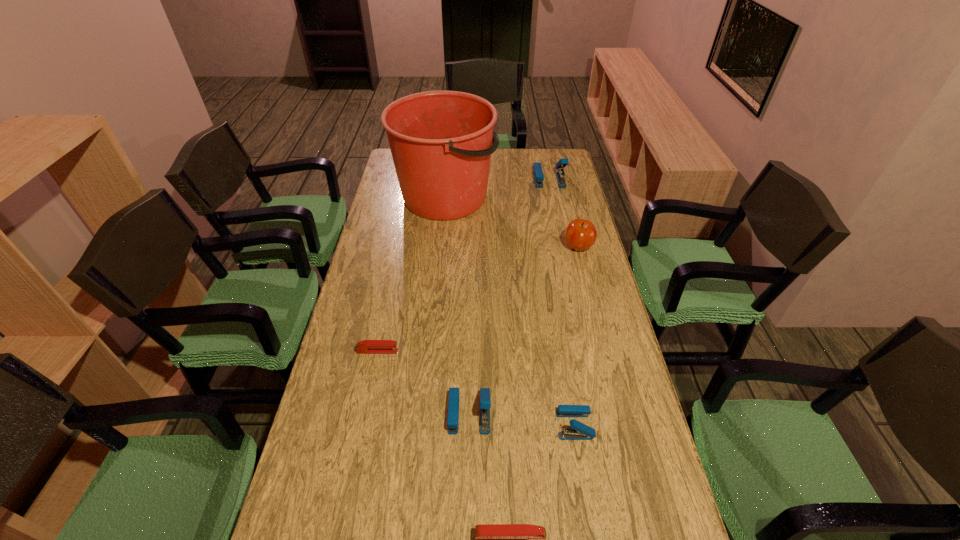
Find the location of a particular element. The height and width of the screenshot is (540, 960). bucket is located at coordinates (441, 142).

In order to click on the tallest object in this screenshot , I will do `click(441, 142)`.

Image resolution: width=960 pixels, height=540 pixels. I want to click on the biggest blue stapler, so click(x=537, y=172).

Image resolution: width=960 pixels, height=540 pixels. In order to click on the farthest stapler in this screenshot , I will do `click(537, 172)`.

Locate an element on the screen. The width and height of the screenshot is (960, 540). apple is located at coordinates point(580,234).

Locate an element on the screen. the fourth shortest stapler is located at coordinates (485, 401).

The width and height of the screenshot is (960, 540). Find the location of `the second smallest blue stapler`. the second smallest blue stapler is located at coordinates (485, 401).

Locate an element on the screen. the third shortest stapler is located at coordinates (579, 431).

Locate an element on the screen. The width and height of the screenshot is (960, 540). the smallest blue stapler is located at coordinates (579, 431).

Where is `the shortest object`? The image size is (960, 540). the shortest object is located at coordinates [366, 346].